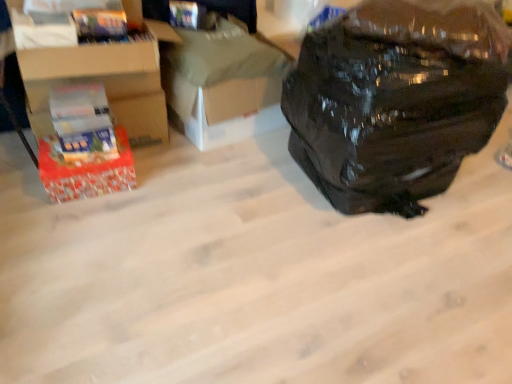
Question: Should I look upward or downward to see white cardboard box at center, marked as the second cardboard box in a left-to-right arrangement?

Choices:
 (A) down
 (B) up

Answer: (B)

Question: Considering the relative sizes of cardboard box at left, placed as the 2th cardboard box when sorted from right to left, and black matte backpack at right in the image provided, is cardboard box at left, placed as the 2th cardboard box when sorted from right to left, wider than black matte backpack at right?

Choices:
 (A) no
 (B) yes

Answer: (A)

Question: From the image's perspective, is cardboard box at left, the first cardboard box in the left-to-right sequence, above black matte backpack at right?

Choices:
 (A) yes
 (B) no

Answer: (A)

Question: Does cardboard box at left, placed as the 2th cardboard box when sorted from right to left, appear on the left side of black matte backpack at right?

Choices:
 (A) no
 (B) yes

Answer: (B)

Question: Considering the relative sizes of cardboard box at left, the first cardboard box in the left-to-right sequence, and black matte backpack at right in the image provided, is cardboard box at left, the first cardboard box in the left-to-right sequence, taller than black matte backpack at right?

Choices:
 (A) no
 (B) yes

Answer: (A)

Question: Does cardboard box at left, placed as the 2th cardboard box when sorted from right to left, come behind black matte backpack at right?

Choices:
 (A) yes
 (B) no

Answer: (A)

Question: Is there a large distance between black matte backpack at right and red cardboard box at left?

Choices:
 (A) yes
 (B) no

Answer: (A)

Question: Considering the relative sizes of black matte backpack at right and red cardboard box at left in the image provided, is black matte backpack at right bigger than red cardboard box at left?

Choices:
 (A) no
 (B) yes

Answer: (B)

Question: Is the depth of black matte backpack at right greater than that of red cardboard box at left?

Choices:
 (A) no
 (B) yes

Answer: (A)

Question: Considering the relative sizes of black matte backpack at right and red cardboard box at left in the image provided, is black matte backpack at right smaller than red cardboard box at left?

Choices:
 (A) no
 (B) yes

Answer: (A)

Question: From a real-world perspective, is black matte backpack at right under red cardboard box at left?

Choices:
 (A) no
 (B) yes

Answer: (A)

Question: Does black matte backpack at right have a lesser height compared to red cardboard box at left?

Choices:
 (A) yes
 (B) no

Answer: (B)

Question: Considering the relative sizes of white cardboard box at center, which is the first cardboard box in right-to-left order, and red cardboard box at left in the image provided, is white cardboard box at center, which is the first cardboard box in right-to-left order, wider than red cardboard box at left?

Choices:
 (A) yes
 (B) no

Answer: (A)